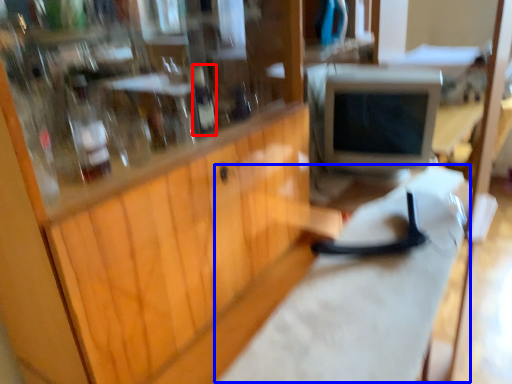
Question: Among these objects, which one is farthest to the camera, bottle (highlighted by a red box) or workbench (highlighted by a blue box)?

Choices:
 (A) bottle
 (B) workbench

Answer: (A)